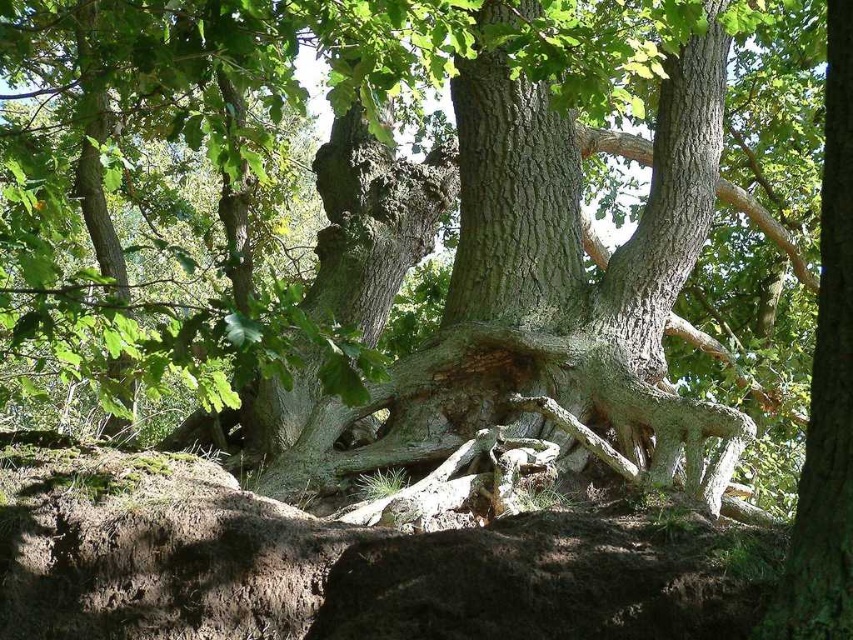
Question: Can you confirm if brown rough rock at lower center is smaller than green rough bark tree trunk at center?

Choices:
 (A) yes
 (B) no

Answer: (B)

Question: Is brown rough rock at lower center behind green rough bark tree trunk at center?

Choices:
 (A) no
 (B) yes

Answer: (B)

Question: Can you confirm if brown rough rock at lower center is positioned below green rough bark tree trunk at center?

Choices:
 (A) no
 (B) yes

Answer: (B)

Question: Which object appears closest to the camera in this image?

Choices:
 (A) brown rough rock at lower center
 (B) green rough bark tree trunk at center

Answer: (B)